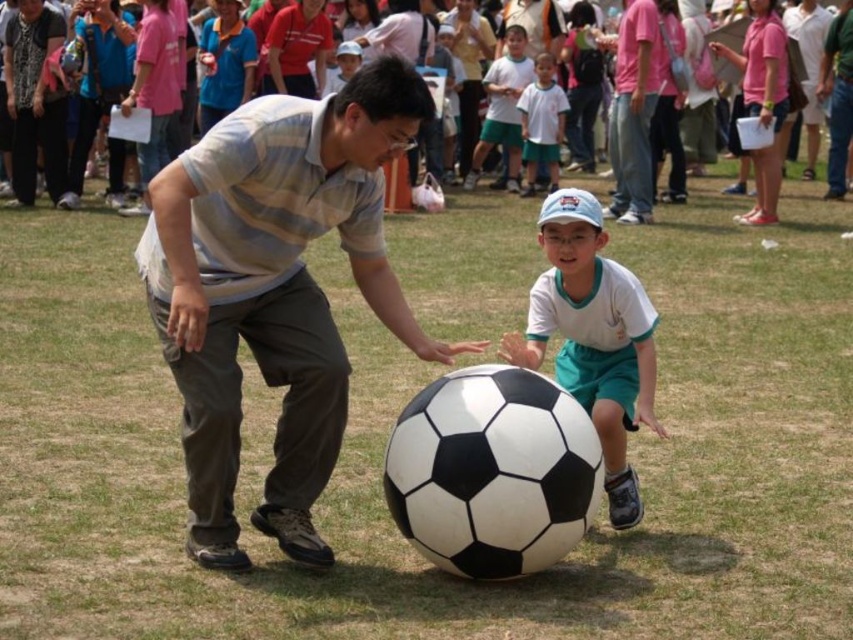
You are a photographer trying to capture a photo of the white matte soccer ball at center and the pink cotton crowd at upper center. Based on their positions, which object is located to the right side of the other?

The white matte soccer ball at center is positioned on the right side of the pink cotton crowd at upper center.

You are a photographer setting up for a soccer game photo shoot. You have two subjects wearing white shirts in the frame. The first subject is wearing a white cotton shirt at upper center, and the second is wearing a white matte shirt at upper center. You need to ensure there is enough space between them for a soccer ball to fit. The soccer ball has a diameter of 8.65 inches. Can the soccer ball fit between the two white shirts?

The distance between the white cotton shirt at upper center and the white matte shirt at upper center is 16.96 inches. Since the soccer ball has a diameter of 8.65 inches, which is less than half the distance between them, the soccer ball can fit between the two shirts.